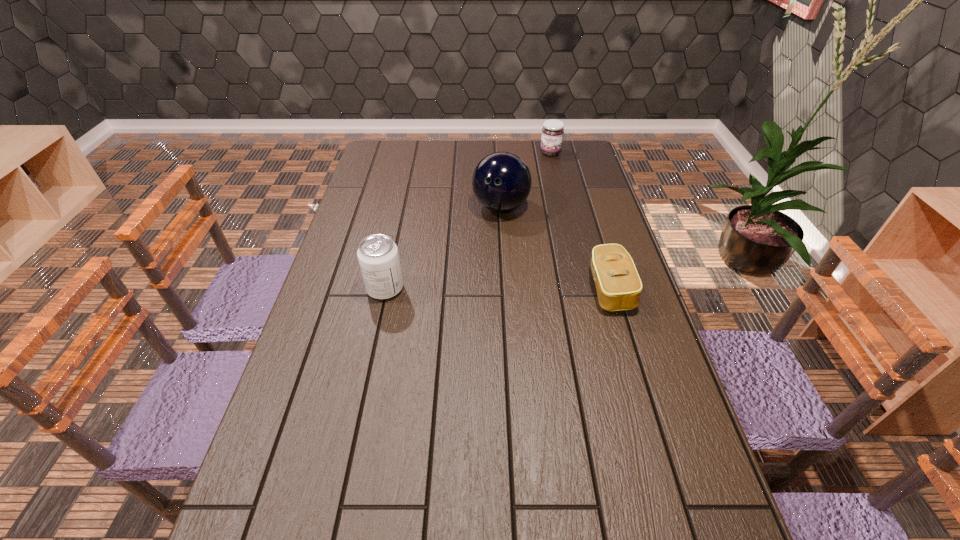
Where is `blank space at the near edge of the desktop`? blank space at the near edge of the desktop is located at coordinates (378, 480).

Where is `vacant region at the left edge`? vacant region at the left edge is located at coordinates (353, 268).

In the image, there is a desktop. Find the location of `vacant space at the right edge`. vacant space at the right edge is located at coordinates (639, 326).

This screenshot has height=540, width=960. In the image, there is a desktop. Find the location of `free region at the far left corner`. free region at the far left corner is located at coordinates coord(406,146).

This screenshot has height=540, width=960. In order to click on free space between the clutch bag and the second farthest object in this screenshot , I will do `click(555, 248)`.

Find the location of a particular element. free area in between the farthest object and the shortest object is located at coordinates (580, 221).

Image resolution: width=960 pixels, height=540 pixels. I want to click on vacant area that lies between the second shortest object and the leftmost object, so click(x=468, y=221).

Identify the location of empty location between the second tallest object and the clutch bag. (497, 289).

I want to click on free space between the leftmost object and the tallest object, so click(443, 248).

The width and height of the screenshot is (960, 540). Identify the location of free space between the third shortest object and the farthest object. (468, 221).